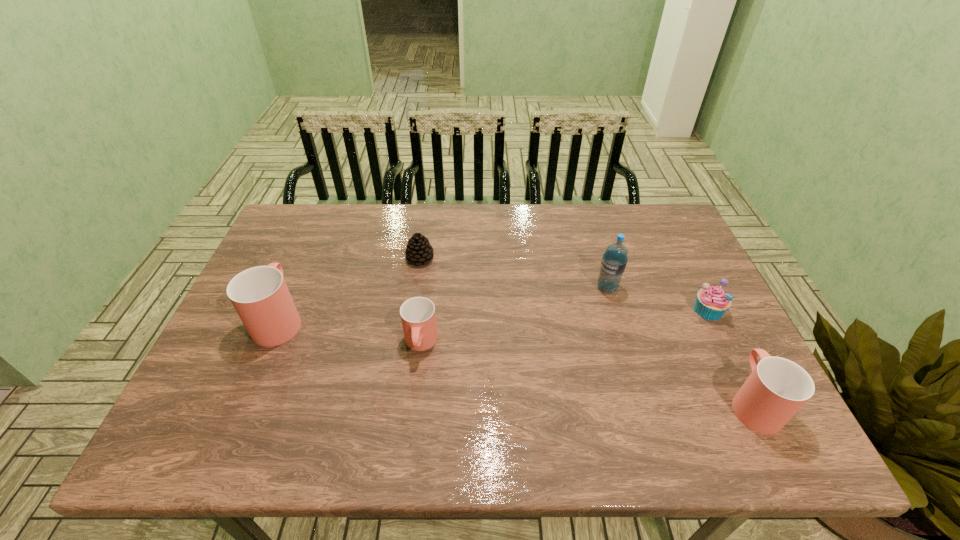
The image size is (960, 540). In order to click on cup present at the right edge in this screenshot , I will do `click(777, 388)`.

The height and width of the screenshot is (540, 960). What are the coordinates of `muffin present at the right edge` in the screenshot? It's located at (711, 303).

I want to click on object located at the near right corner, so click(777, 388).

This screenshot has width=960, height=540. In order to click on free space at the far edge in this screenshot , I will do `click(576, 224)`.

Where is `free location at the near edge of the desktop`? free location at the near edge of the desktop is located at coordinates (308, 384).

Identify the location of vacant space at the left edge of the desktop. The height and width of the screenshot is (540, 960). (294, 258).

Find the location of `free space at the right edge of the desktop`. free space at the right edge of the desktop is located at coordinates (687, 252).

Where is `free space at the far left corner of the desktop`? The width and height of the screenshot is (960, 540). free space at the far left corner of the desktop is located at coordinates (298, 235).

The image size is (960, 540). I want to click on empty location between the muffin and the fifth shortest object, so click(x=494, y=314).

The width and height of the screenshot is (960, 540). I want to click on empty space that is in between the tallest cup and the pinecone, so click(350, 289).